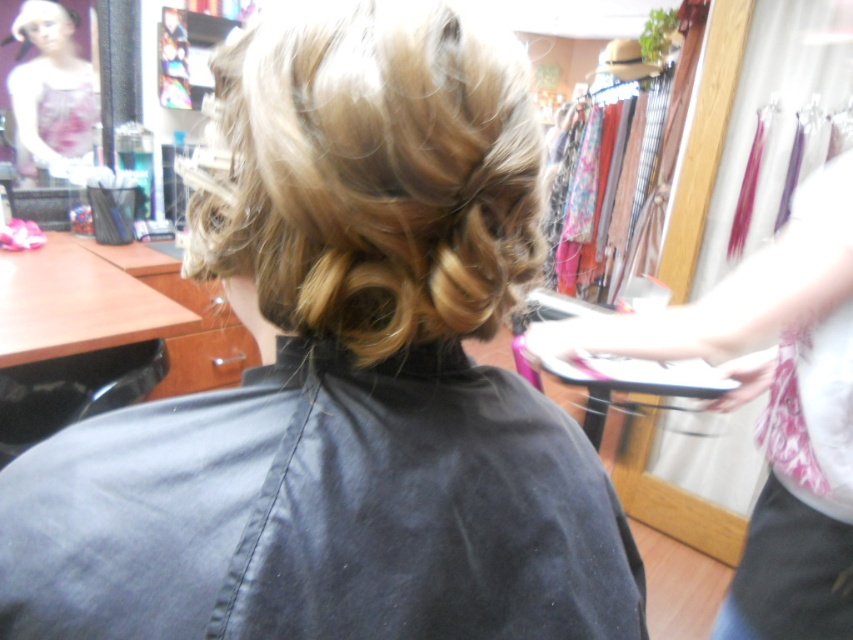
Can you confirm if blonde curly hair at center is taller than matte floral apron at upper left?

No, blonde curly hair at center is not taller than matte floral apron at upper left.

Which is behind, point (386, 147) or point (39, 17)?

Point (39, 17)

Which is in front, point (476, 116) or point (62, 156)?

Point (476, 116)

At what (x,y) coordinates should I click in order to perform the action: click on blonde curly hair at center. Please return your answer as a coordinate pair (x, y). Image resolution: width=853 pixels, height=640 pixels. Looking at the image, I should click on (376, 176).

Between white fabric at right and matte floral apron at upper left, which one is positioned higher?

Positioned higher is matte floral apron at upper left.

The image size is (853, 640). Identify the location of white fabric at right. (773, 404).

Who is higher up, blonde curly hair at center or white fabric at right?

blonde curly hair at center

Does point (305, 264) come closer to viewer compared to point (816, 556)?

Yes, point (305, 264) is closer to viewer.

I want to click on blonde curly hair at center, so 376,176.